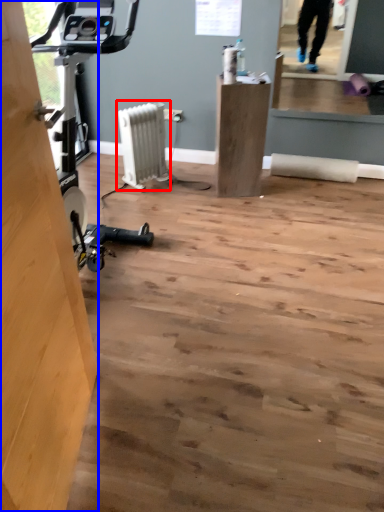
Question: Which point is further to the camera, radiator (highlighted by a red box) or plywood (highlighted by a blue box)?

Choices:
 (A) radiator
 (B) plywood

Answer: (A)